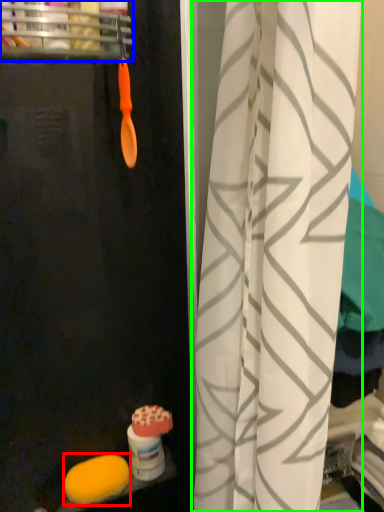
Question: Which object is the closest to the food (highlighted by a red box)? Choose among these: shelf (highlighted by a blue box) or curtain (highlighted by a green box).

Choices:
 (A) shelf
 (B) curtain

Answer: (B)